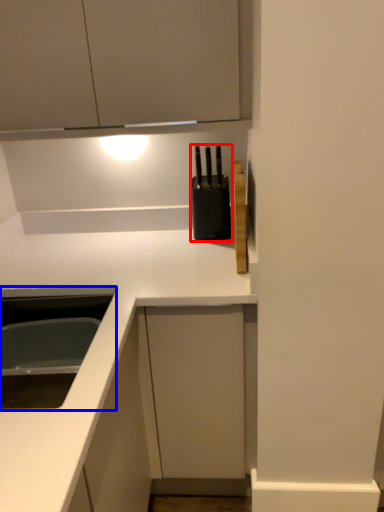
Question: Which object is further to the camera taking this photo, appliance (highlighted by a red box) or sink (highlighted by a blue box)?

Choices:
 (A) appliance
 (B) sink

Answer: (A)